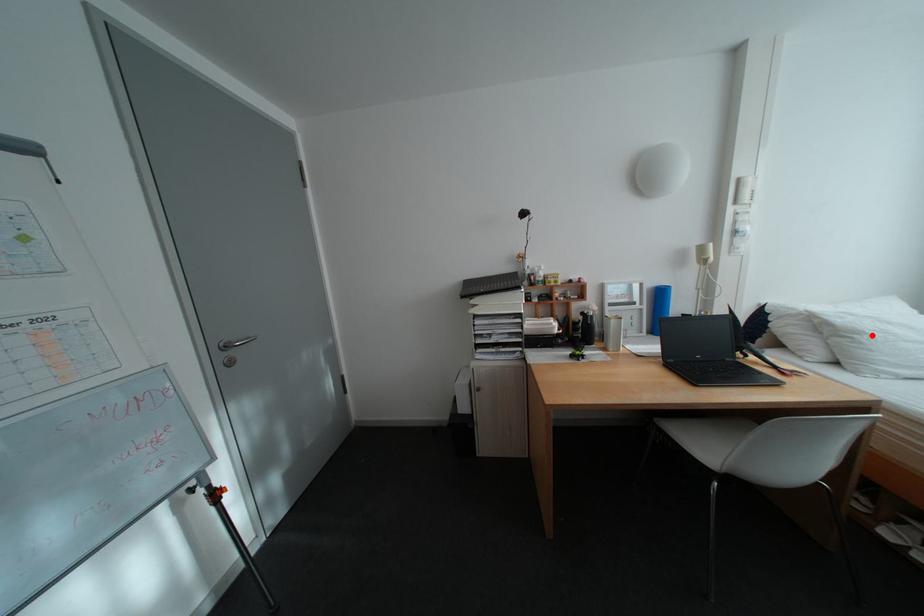
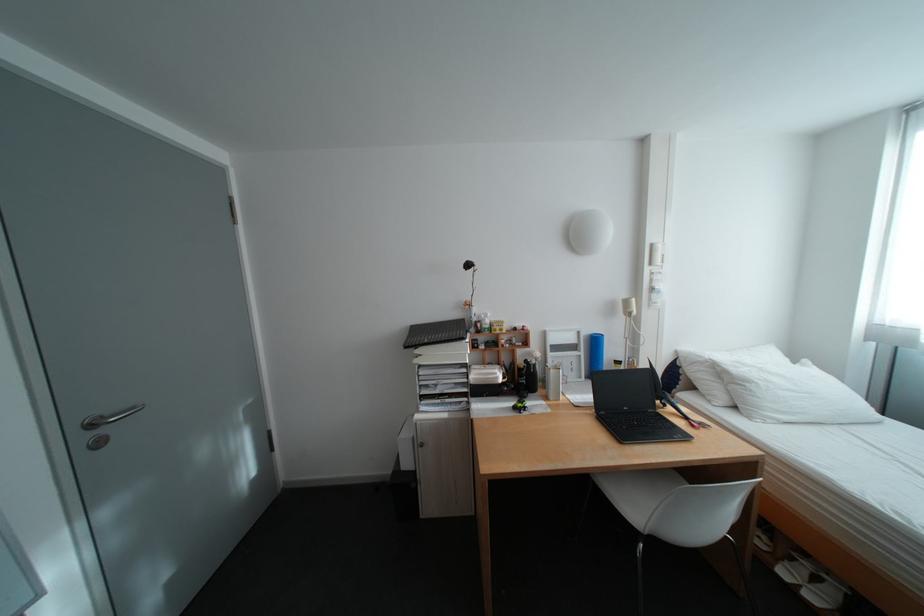
In the second image, find the point that corresponds to the highlighted location in the first image.

(761, 384)